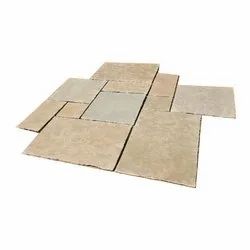
At what (x,y) coordinates should I click in order to perform the action: click on rectangle shaped tiles. Please return your answer as a coordinate pair (x, y). Looking at the image, I should click on (45, 115), (133, 72), (133, 88), (170, 88), (160, 122), (74, 137).